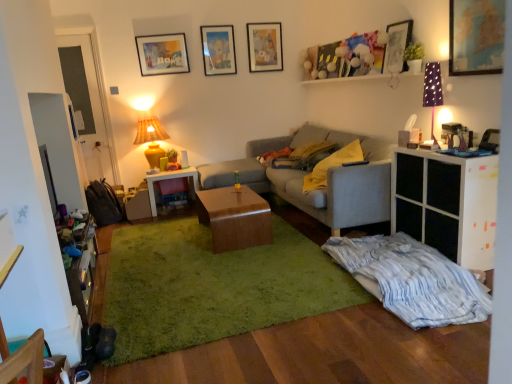
Question: Is matte yellow ceramic lamp at upper left, placed as the first lamp when sorted from back to front, placed right next to matte paper picture frame at upper center, placed as the third picture frame when sorted from front to back?

Choices:
 (A) yes
 (B) no

Answer: (B)

Question: Is matte yellow ceramic lamp at upper left, the 1th lamp from the left, thinner than matte paper picture frame at upper center, positioned as the 1th picture frame in left-to-right order?

Choices:
 (A) yes
 (B) no

Answer: (B)

Question: From the image's perspective, is matte yellow ceramic lamp at upper left, acting as the second lamp starting from the right, above matte paper picture frame at upper center, positioned as the 1th picture frame in left-to-right order?

Choices:
 (A) yes
 (B) no

Answer: (B)

Question: Is matte yellow ceramic lamp at upper left, the 1th lamp from the left, further to the viewer compared to matte paper picture frame at upper center, which ranks as the fifth picture frame in right-to-left order?

Choices:
 (A) no
 (B) yes

Answer: (A)

Question: Can you confirm if matte yellow ceramic lamp at upper left, the 1th lamp from the left, is smaller than matte paper picture frame at upper center, the third picture frame in the back-to-front sequence?

Choices:
 (A) yes
 (B) no

Answer: (B)

Question: Is matte yellow ceramic lamp at upper left, placed as the first lamp when sorted from back to front, facing away from matte paper picture frame at upper center, positioned as the 1th picture frame in left-to-right order?

Choices:
 (A) yes
 (B) no

Answer: (B)

Question: Considering the relative sizes of matte paper picture frame at upper center, the third picture frame in the back-to-front sequence, and matte yellow ceramic lamp at upper left, acting as the second lamp starting from the right, in the image provided, is matte paper picture frame at upper center, the third picture frame in the back-to-front sequence, bigger than matte yellow ceramic lamp at upper left, acting as the second lamp starting from the right,?

Choices:
 (A) no
 (B) yes

Answer: (A)

Question: Is matte paper picture frame at upper center, placed as the third picture frame when sorted from front to back, positioned beyond the bounds of matte yellow ceramic lamp at upper left, placed as the first lamp when sorted from back to front?

Choices:
 (A) no
 (B) yes

Answer: (B)

Question: From a real-world perspective, is matte paper picture frame at upper center, the third picture frame in the back-to-front sequence, under matte yellow ceramic lamp at upper left, the 1th lamp from the left?

Choices:
 (A) yes
 (B) no

Answer: (B)

Question: Does matte paper picture frame at upper center, placed as the third picture frame when sorted from front to back, have a lesser width compared to matte yellow ceramic lamp at upper left, the 2th lamp viewed from the front?

Choices:
 (A) yes
 (B) no

Answer: (A)

Question: From the image's perspective, is matte paper picture frame at upper center, the third picture frame in the back-to-front sequence, located beneath matte yellow ceramic lamp at upper left, the 1th lamp from the left?

Choices:
 (A) yes
 (B) no

Answer: (B)

Question: Is matte paper picture frame at upper center, placed as the third picture frame when sorted from front to back, positioned before matte yellow ceramic lamp at upper left, the 2th lamp viewed from the front?

Choices:
 (A) yes
 (B) no

Answer: (B)

Question: Is wooden armchair at lower left oriented away from white matte cabinet at right?

Choices:
 (A) no
 (B) yes

Answer: (A)